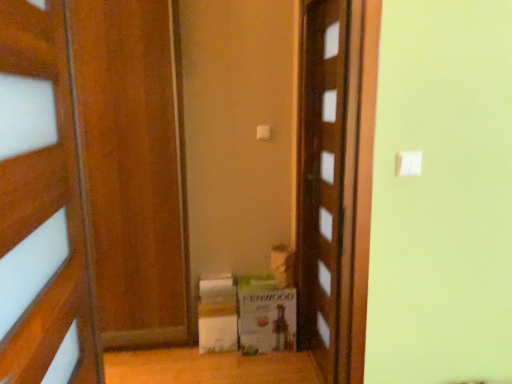
Question: Is wooden door at left, which ranks as the first door in front-to-back order, closer to camera compared to white cardboard box at lower center, positioned as the 2th cardboard box in right-to-left order?

Choices:
 (A) no
 (B) yes

Answer: (B)

Question: Considering the relative sizes of wooden door at left, which is the 2th door in back-to-front order, and white cardboard box at lower center, positioned as the 2th cardboard box in right-to-left order, in the image provided, is wooden door at left, which is the 2th door in back-to-front order, smaller than white cardboard box at lower center, positioned as the 2th cardboard box in right-to-left order,?

Choices:
 (A) no
 (B) yes

Answer: (A)

Question: Is wooden door at left, which is the 2th door in back-to-front order, turned away from white cardboard box at lower center, positioned as the 2th cardboard box in right-to-left order?

Choices:
 (A) yes
 (B) no

Answer: (B)

Question: Would you say wooden door at left, which ranks as the first door in front-to-back order, contains white cardboard box at lower center, positioned as the 2th cardboard box in right-to-left order?

Choices:
 (A) yes
 (B) no

Answer: (B)

Question: Does wooden door at left, which ranks as the first door in front-to-back order, have a lesser width compared to white cardboard box at lower center, positioned as the 2th cardboard box in right-to-left order?

Choices:
 (A) no
 (B) yes

Answer: (B)

Question: Is wooden door at left, which is the second door in right-to-left order, in front of or behind wooden door at center, acting as the 2th door starting from the front, in the image?

Choices:
 (A) behind
 (B) front

Answer: (B)

Question: Is point (53, 304) positioned closer to the camera than point (344, 160)?

Choices:
 (A) closer
 (B) farther

Answer: (A)

Question: From a real-world perspective, is wooden door at left, which is the 2th door in back-to-front order, physically located above or below wooden door at center, acting as the 2th door starting from the front?

Choices:
 (A) above
 (B) below

Answer: (A)

Question: Visually, is wooden door at left, which is the second door in right-to-left order, positioned to the left or to the right of wooden door at center, which ranks as the second door in left-to-right order?

Choices:
 (A) left
 (B) right

Answer: (A)

Question: Considering the positions of green cardboard box at center, which ranks as the 2th cardboard box in left-to-right order, and white cardboard box at lower center, positioned as the 2th cardboard box in right-to-left order, in the image, is green cardboard box at center, which ranks as the 2th cardboard box in left-to-right order, wider or thinner than white cardboard box at lower center, positioned as the 2th cardboard box in right-to-left order,?

Choices:
 (A) thin
 (B) wide

Answer: (B)

Question: Would you say green cardboard box at center, placed as the 1th cardboard box when sorted from right to left, is inside or outside white cardboard box at lower center, the first cardboard box viewed from the left?

Choices:
 (A) inside
 (B) outside

Answer: (B)

Question: From a real-world perspective, is green cardboard box at center, which ranks as the 2th cardboard box in left-to-right order, physically located above or below white cardboard box at lower center, positioned as the 2th cardboard box in right-to-left order?

Choices:
 (A) below
 (B) above

Answer: (B)

Question: Is point (266, 334) closer or farther from the camera than point (201, 301)?

Choices:
 (A) farther
 (B) closer

Answer: (B)

Question: From a real-world perspective, is wooden door at left, which ranks as the first door in front-to-back order, positioned above or below white cardboard box at lower center, the first cardboard box viewed from the left?

Choices:
 (A) above
 (B) below

Answer: (A)

Question: In terms of width, does wooden door at left, which ranks as the first door in front-to-back order, look wider or thinner when compared to white cardboard box at lower center, the first cardboard box viewed from the left?

Choices:
 (A) wide
 (B) thin

Answer: (B)